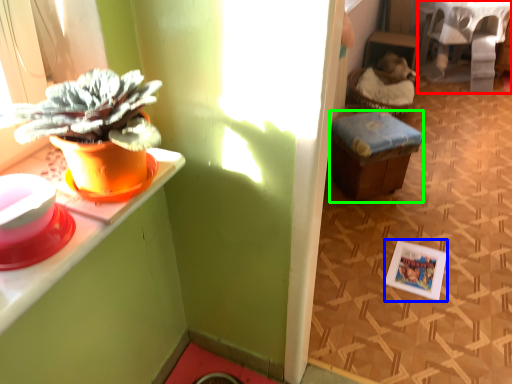
Question: Considering the real-world distances, which object is closest to table (highlighted by a red box)? picture frame (highlighted by a blue box) or stool (highlighted by a green box).

Choices:
 (A) picture frame
 (B) stool

Answer: (B)